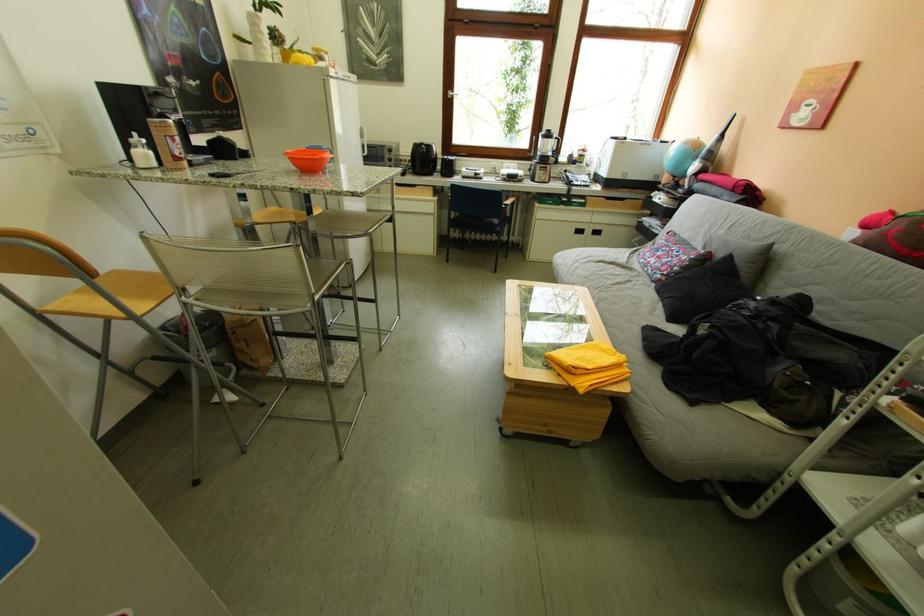
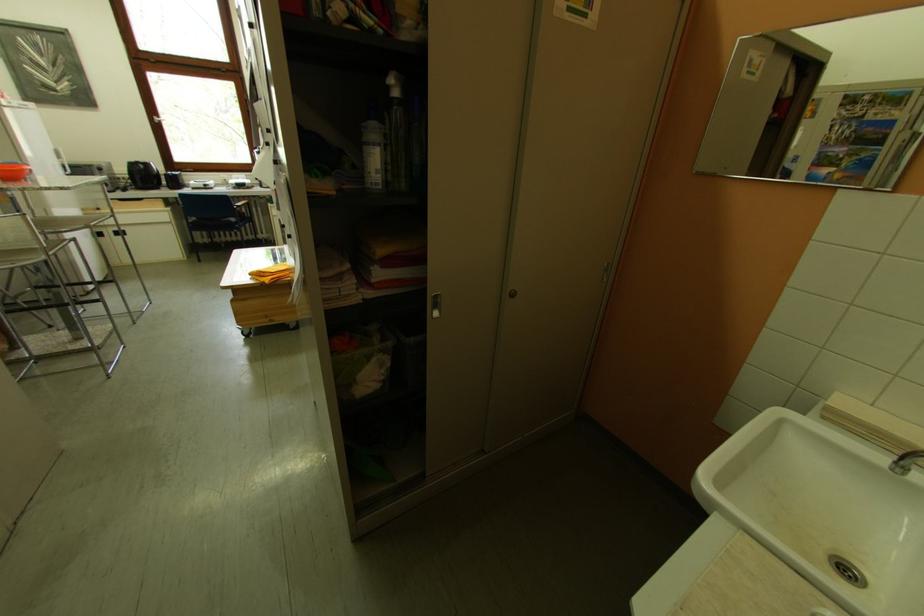
Locate, in the second image, the point that corresponds to point 466,225 in the first image.

(207, 230)